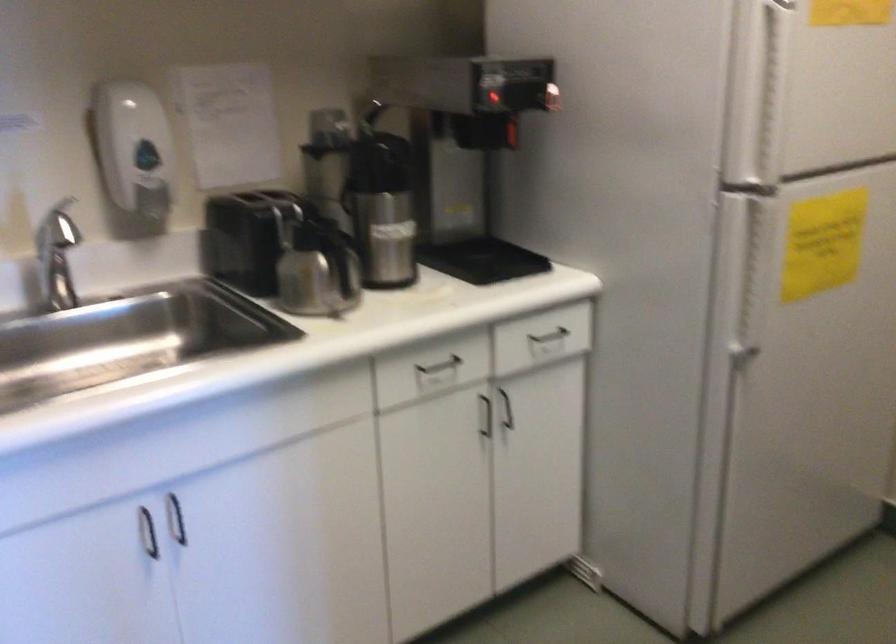
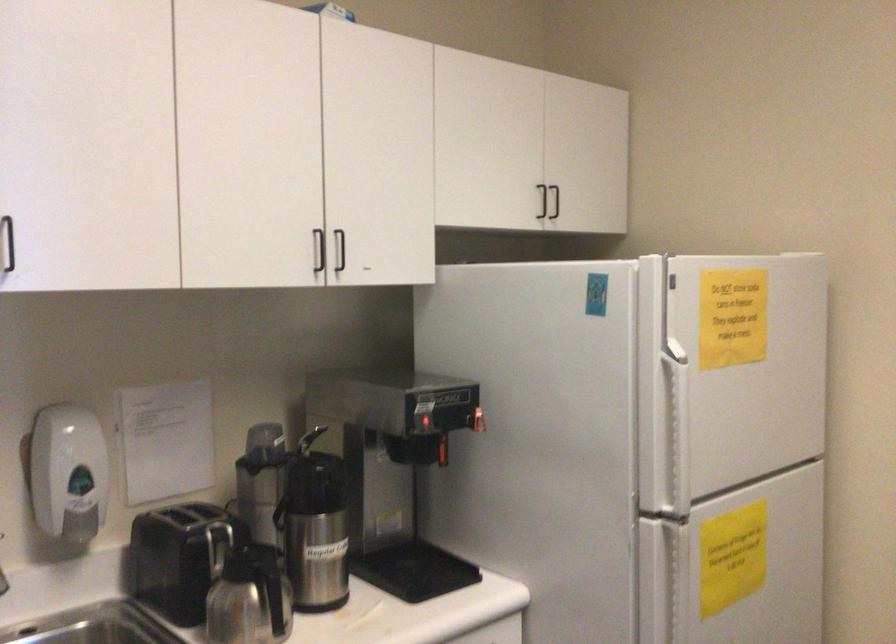
Locate, in the second image, the point that corresponds to [756,254] in the first image.

(675, 583)